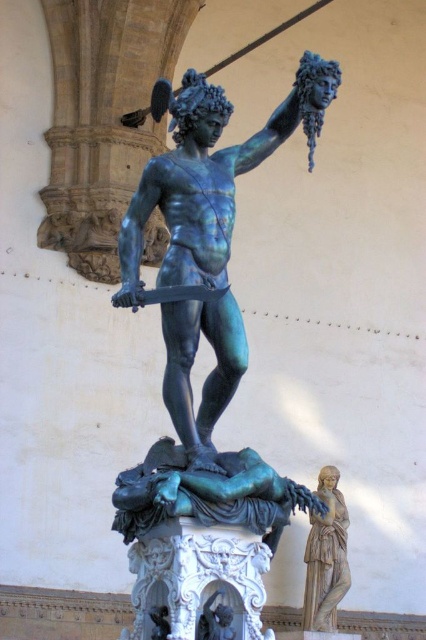
You are an art student visiting a sculpture garden and notice two statues. You see a bronze warrior at center and a smooth beige statue at right. Which statue is taller?

The bronze warrior at center is much taller than the smooth beige statue at right.

You are a tour guide leading a group of visitors in the courtyard. You want to point out the bronze warrior at center and the pedestal it stands on. How far apart are they?

The bronze warrior at center and the pedestal it stands on are 38.04 meters apart.

You are an art student observing the courtyard. You need to sketch the bronze warrior at center and the smooth beige statue at right. Which one should you sketch first if you want to start with the one on the left side of your view?

The bronze warrior at center is to the left of the smooth beige statue at right, so you should sketch the bronze warrior at center first since it is on the left side of your view.